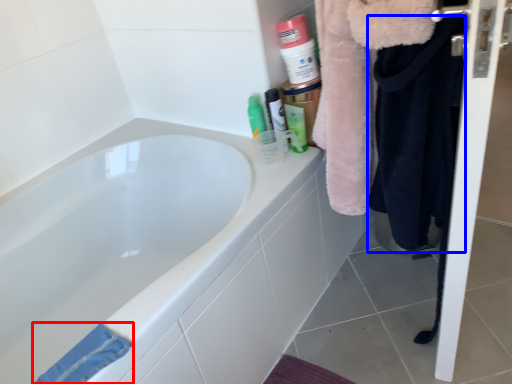
Question: Among these objects, which one is farthest to the camera, bath towel (highlighted by a red box) or clothing (highlighted by a blue box)?

Choices:
 (A) bath towel
 (B) clothing

Answer: (B)